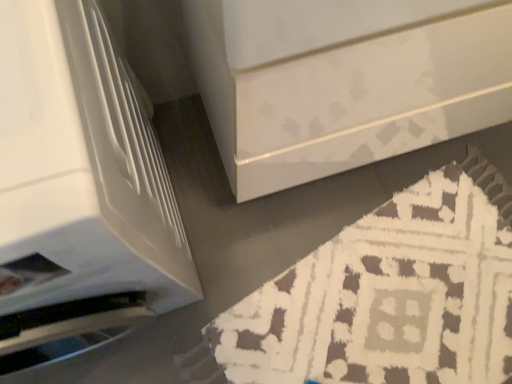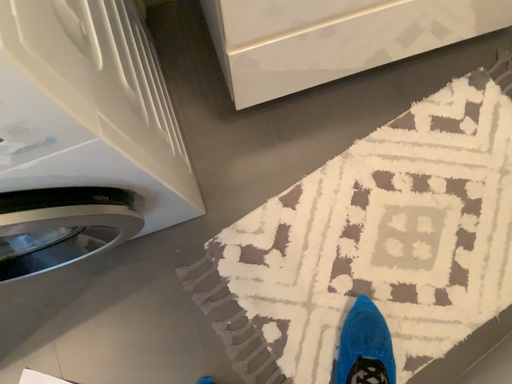
Question: How did the camera likely rotate when shooting the video?

Choices:
 (A) rotated downward
 (B) rotated upward

Answer: (A)